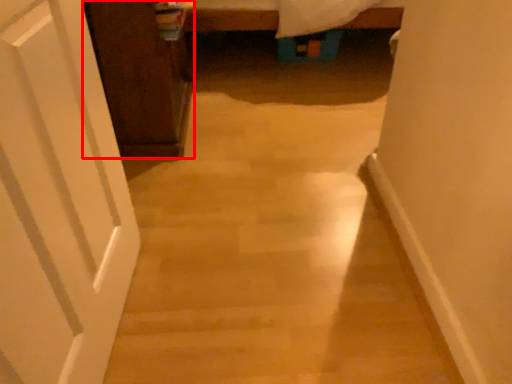
Question: From the image, what is the correct spatial relationship of cabinetry (annotated by the red box) in relation to door?

Choices:
 (A) left
 (B) right

Answer: (A)